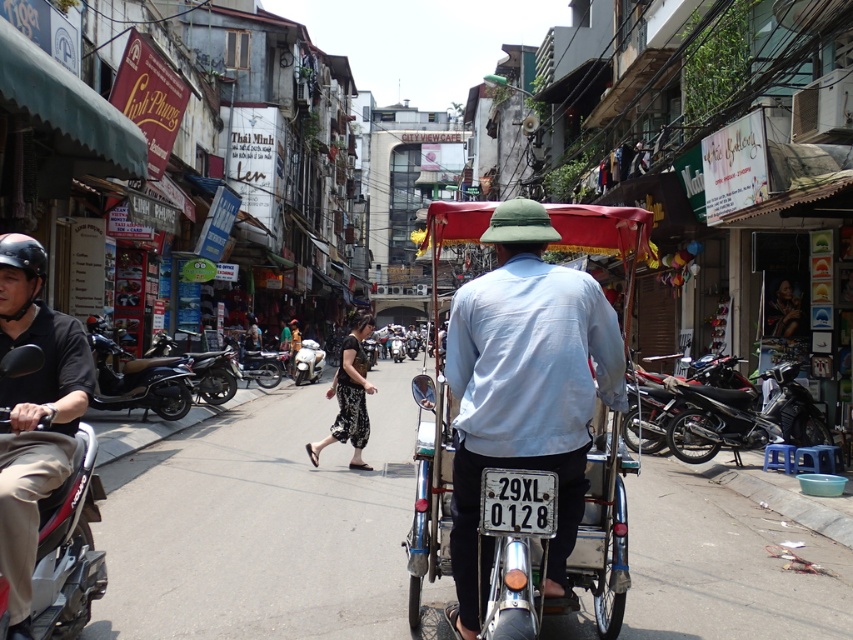
You are standing at the point marked as point (743, 417). Which object is exactly at your location?

The black matte motorcycle at right is exactly at point (743, 417).

You are a delivery person who needs to cross the street to deliver a package. There is a light blue fabric shirt at center and a silver metallic scooter at center in your path. Given that you can move at a speed of 1.5 meters per second, how many seconds will it take you to pass between them?

The light blue fabric shirt at center and the silver metallic scooter at center are 19.33 meters apart. At a speed of 1.5 meters per second, it would take approximately 12.89 seconds to pass between them.

You are a delivery person needing to park your vehicle in a tight space. You have a choice between the black matte motorcycle at right and the metallic silver scooter at center. Which vehicle would you choose to park in the tight space?

You should choose the black matte motorcycle at right because it occupies less space than the metallic silver scooter at center, making it more suitable for tight parking areas.